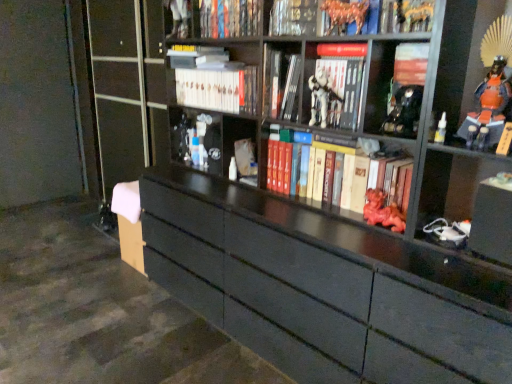
Question: From the image's perspective, is hardcover book at upper center, the first book in the top-to-bottom sequence, below hardcover book at upper center, the second book viewed from the top?

Choices:
 (A) no
 (B) yes

Answer: (A)

Question: Does hardcover book at upper center, the first book in the top-to-bottom sequence, appear on the right side of hardcover book at upper center, the second book viewed from the top?

Choices:
 (A) yes
 (B) no

Answer: (B)

Question: Is hardcover book at upper center, the first book in the top-to-bottom sequence, positioned beyond the bounds of hardcover book at upper center, the second book viewed from the top?

Choices:
 (A) no
 (B) yes

Answer: (B)

Question: Is hardcover book at upper center, marked as the 8th book in a bottom-to-top arrangement, oriented towards hardcover book at upper center, the second book viewed from the top?

Choices:
 (A) no
 (B) yes

Answer: (A)

Question: Does hardcover book at upper center, the first book in the top-to-bottom sequence, have a greater width compared to hardcover book at upper center, the second book viewed from the top?

Choices:
 (A) no
 (B) yes

Answer: (A)

Question: Considering the relative sizes of hardcover book at upper center, marked as the 8th book in a bottom-to-top arrangement, and hardcover book at upper center, the second book viewed from the top, in the image provided, is hardcover book at upper center, marked as the 8th book in a bottom-to-top arrangement, thinner than hardcover book at upper center, the second book viewed from the top,?

Choices:
 (A) yes
 (B) no

Answer: (A)

Question: From the image's perspective, is metallic black figurine at center, the sixth toy when ordered from right to left, located above hardcover book at upper center, the 7th book in the bottom-to-top sequence?

Choices:
 (A) yes
 (B) no

Answer: (B)

Question: From a real-world perspective, is metallic black figurine at center, which ranks as the 1th toy in back-to-front order, on hardcover book at upper center, the second book viewed from the top?

Choices:
 (A) no
 (B) yes

Answer: (A)

Question: From a real-world perspective, is metallic black figurine at center, which is counted as the sixth toy, starting from the front, physically below hardcover book at upper center, the second book viewed from the top?

Choices:
 (A) no
 (B) yes

Answer: (B)

Question: Is metallic black figurine at center, which is counted as the sixth toy, starting from the front, not near hardcover book at upper center, the second book viewed from the top?

Choices:
 (A) yes
 (B) no

Answer: (B)

Question: Considering the relative sizes of metallic black figurine at center, which ranks as the 1th toy in back-to-front order, and hardcover book at upper center, the 7th book in the bottom-to-top sequence, in the image provided, is metallic black figurine at center, which ranks as the 1th toy in back-to-front order, taller than hardcover book at upper center, the 7th book in the bottom-to-top sequence,?

Choices:
 (A) no
 (B) yes

Answer: (B)

Question: Does metallic black figurine at center, the sixth toy when ordered from right to left, have a greater width compared to hardcover book at upper center, the 7th book in the bottom-to-top sequence?

Choices:
 (A) yes
 (B) no

Answer: (B)

Question: From a real-world perspective, is white plastic figure at center located beneath translucent plastic bottle at upper right, the 2th toy when ordered from front to back?

Choices:
 (A) no
 (B) yes

Answer: (A)